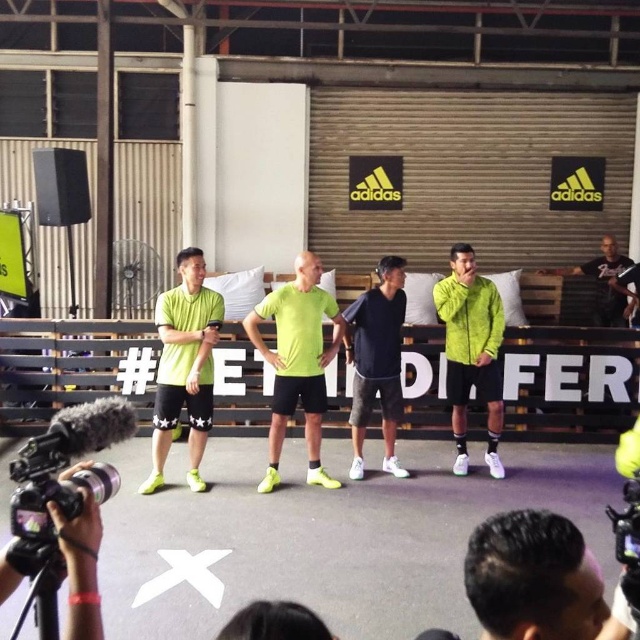
Between point (572, 621) and point (112, 476), which one is positioned behind?

Point (112, 476)

Can you confirm if dark brown hair at center is shorter than black matte video camera at lower left?

Yes, dark brown hair at center is shorter than black matte video camera at lower left.

Between point (509, 561) and point (104, 400), which one is positioned behind?

Positioned behind is point (104, 400).

Identify the location of dark brown hair at center. The width and height of the screenshot is (640, 640). (532, 579).

Can you confirm if neon green fabric jacket at center is positioned to the right of black matte t-shirt at right?

No, neon green fabric jacket at center is not to the right of black matte t-shirt at right.

Who is more distant from viewer, (x=492, y=291) or (x=624, y=284)?

Positioned behind is point (x=624, y=284).

You are a GUI agent. You are given a task and a screenshot of the screen. Output one action in this format:
    pyautogui.click(x=<x>, y=<y>)
    Task: Click on the neon green fabric jacket at center
    The image size is (640, 640).
    Given the screenshot: What is the action you would take?
    pyautogui.click(x=472, y=352)

Does matte green shorts at center come in front of dark blue jersey at center?

Yes, it is in front of dark blue jersey at center.

Which is behind, point (208, 371) or point (365, 316)?

Positioned behind is point (365, 316).

Locate an element on the screen. matte green shorts at center is located at coordinates (184, 365).